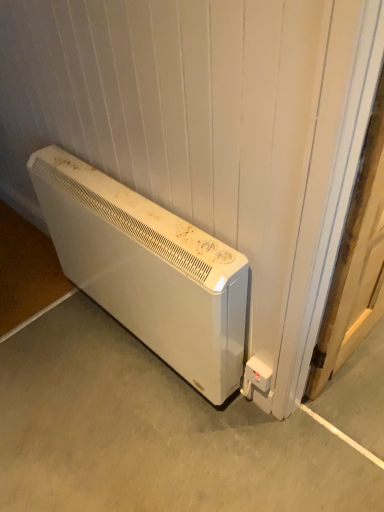
Question: Can you confirm if white matte heater at lower left is thinner than white matte heater at lower left?

Choices:
 (A) no
 (B) yes

Answer: (A)

Question: Does white matte heater at lower left appear on the right side of white matte heater at lower left?

Choices:
 (A) no
 (B) yes

Answer: (A)

Question: From the image's perspective, is white matte heater at lower left above white matte heater at lower left?

Choices:
 (A) yes
 (B) no

Answer: (B)

Question: Is white matte heater at lower left further to the viewer compared to white matte heater at lower left?

Choices:
 (A) no
 (B) yes

Answer: (A)

Question: Would you say white matte heater at lower left contains white matte heater at lower left?

Choices:
 (A) no
 (B) yes

Answer: (A)

Question: From the image's perspective, is white matte heater at lower left below white matte heater at lower left?

Choices:
 (A) yes
 (B) no

Answer: (A)

Question: Can you confirm if wooden door at right is taller than white matte heater at lower left?

Choices:
 (A) yes
 (B) no

Answer: (A)

Question: From the image's perspective, is wooden door at right located above white matte heater at lower left?

Choices:
 (A) yes
 (B) no

Answer: (A)

Question: Considering the relative sizes of wooden door at right and white matte heater at lower left in the image provided, is wooden door at right thinner than white matte heater at lower left?

Choices:
 (A) yes
 (B) no

Answer: (A)

Question: Does wooden door at right come in front of white matte heater at lower left?

Choices:
 (A) no
 (B) yes

Answer: (B)

Question: Is wooden door at right behind white matte heater at lower left?

Choices:
 (A) yes
 (B) no

Answer: (B)

Question: From a real-world perspective, is wooden door at right over white matte heater at lower left?

Choices:
 (A) no
 (B) yes

Answer: (B)

Question: Is white plastic electric outlet at lower right bigger than wooden door at right?

Choices:
 (A) yes
 (B) no

Answer: (B)